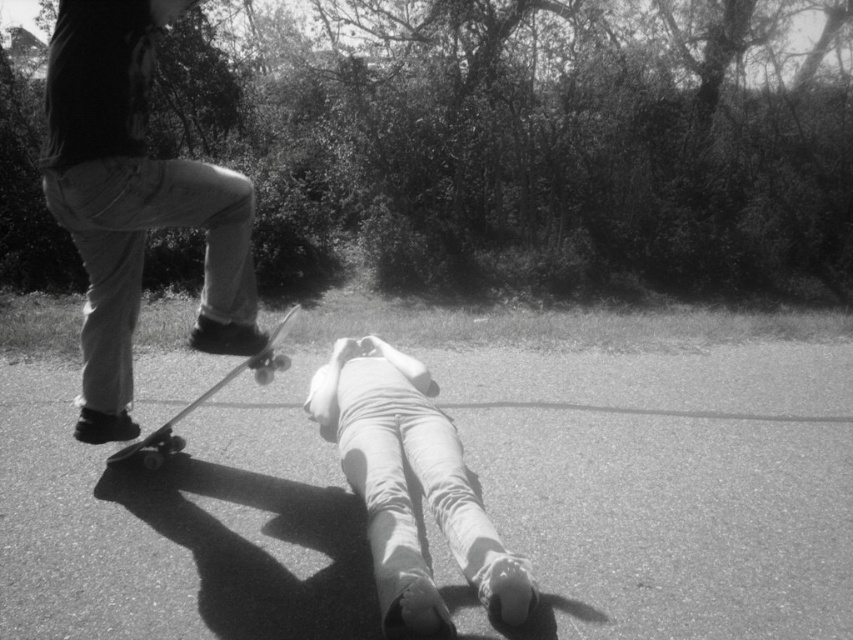
Does dark gray jeans at left have a larger size compared to smooth wood skateboard at lower left?

Yes.

The image size is (853, 640). Describe the element at coordinates (132, 200) in the screenshot. I see `dark gray jeans at left` at that location.

This screenshot has width=853, height=640. What are the coordinates of `dark gray jeans at left` in the screenshot? It's located at (132, 200).

Can you confirm if dark gray jeans at left is thinner than denim jeans at center?

No, dark gray jeans at left is not thinner than denim jeans at center.

The width and height of the screenshot is (853, 640). What do you see at coordinates (132, 200) in the screenshot?
I see `dark gray jeans at left` at bounding box center [132, 200].

This screenshot has height=640, width=853. I want to click on dark gray jeans at left, so click(132, 200).

Is denim jeans at center below smooth wood skateboard at lower left?

Yes.

In the scene shown: Who is positioned more to the left, denim jeans at center or smooth wood skateboard at lower left?

smooth wood skateboard at lower left

Does point (366, 369) come in front of point (265, 349)?

No, it is behind (265, 349).

Where is `denim jeans at center`? Image resolution: width=853 pixels, height=640 pixels. denim jeans at center is located at coordinates (408, 488).